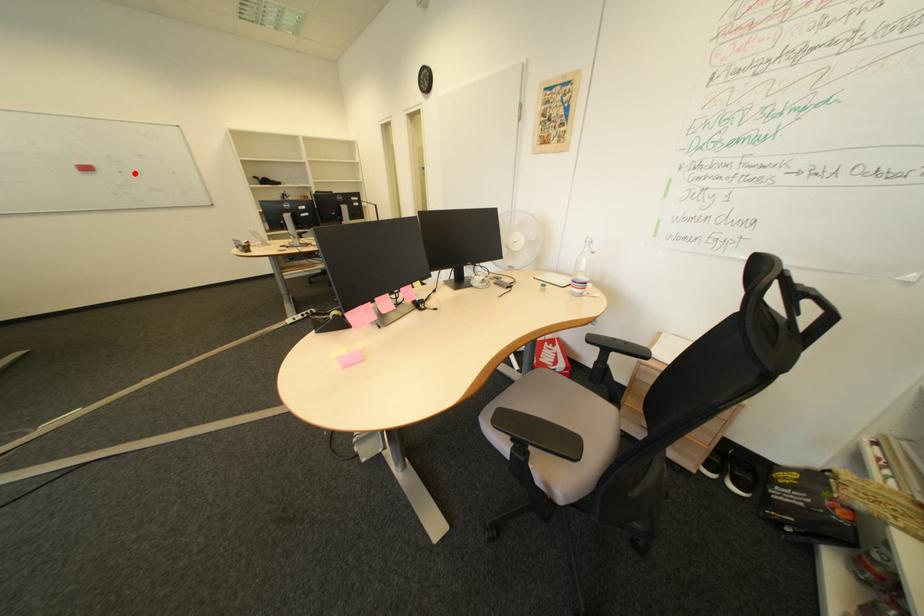
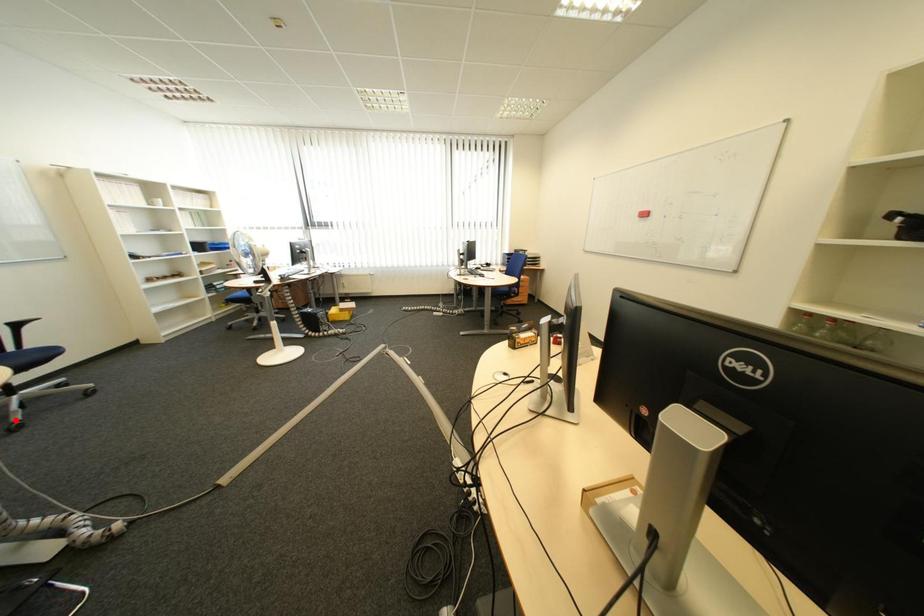
I am providing you with two images of the same scene from different viewpoints. A red point is marked on the first image and another point is marked on the second image. Do the highlighted points in image1 and image2 indicate the same real-world spot?

No